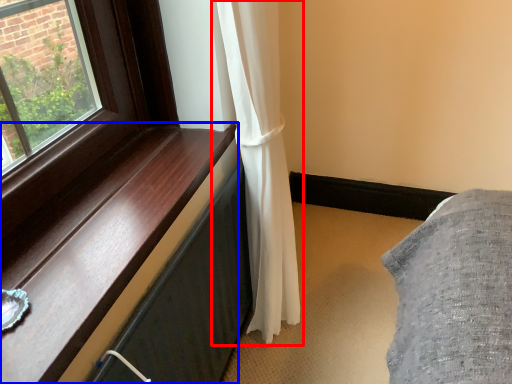
Question: Which of the following is the farthest to the observer, curtain (highlighted by a red box) or window sill (highlighted by a blue box)?

Choices:
 (A) curtain
 (B) window sill

Answer: (A)